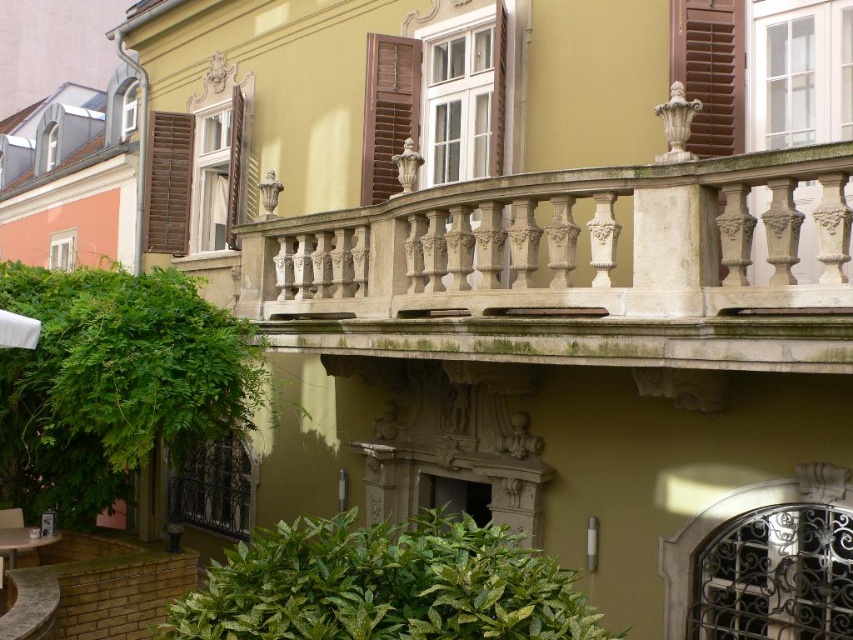
Is white stone railing at upper center thinner than brown wooden shutter at left?

Incorrect, white stone railing at upper center's width is not less than brown wooden shutter at left's.

Can you confirm if white stone railing at upper center is positioned to the right of brown wooden shutter at left?

Correct, you'll find white stone railing at upper center to the right of brown wooden shutter at left.

The width and height of the screenshot is (853, 640). I want to click on white stone railing at upper center, so click(572, 268).

Looking at this image, between brown wooden shutter at left and white fabric umbrella at lower left, which one appears on the left side from the viewer's perspective?

brown wooden shutter at left

Identify the location of brown wooden shutter at left. This screenshot has width=853, height=640. (167, 182).

Where is `brown wooden shutter at left`? The image size is (853, 640). brown wooden shutter at left is located at coordinates (167, 182).

At what (x,y) coordinates should I click in order to perform the action: click on brown wooden shutter at left. Please return your answer as a coordinate pair (x, y). Looking at the image, I should click on (167, 182).

Can you confirm if brown wooden shutter at left is shorter than wooden at upper left?

Yes.

Who is lower down, brown wooden shutter at left or wooden at upper left?

brown wooden shutter at left is lower down.

What do you see at coordinates (167, 182) in the screenshot? I see `brown wooden shutter at left` at bounding box center [167, 182].

Where is `brown wooden shutter at left`? Image resolution: width=853 pixels, height=640 pixels. brown wooden shutter at left is located at coordinates (167, 182).